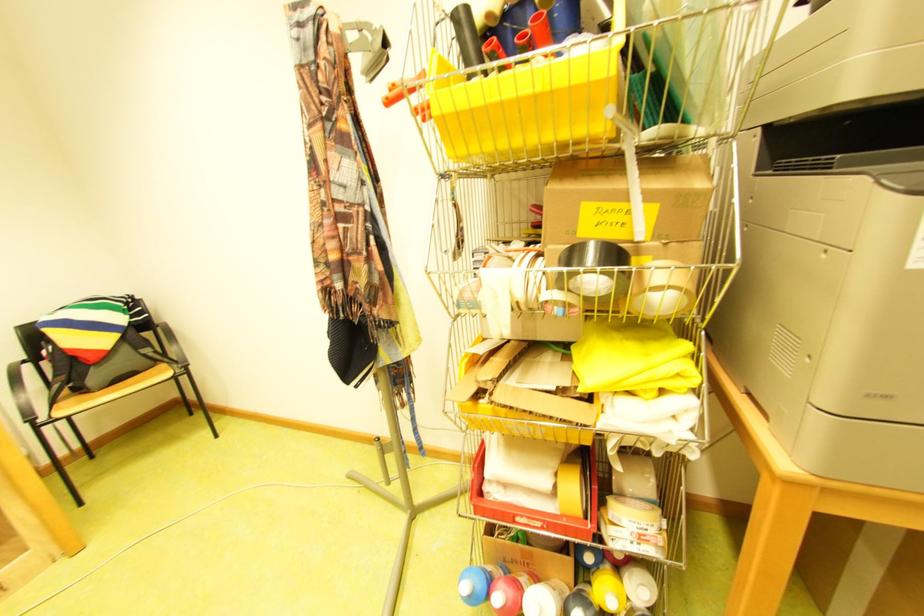
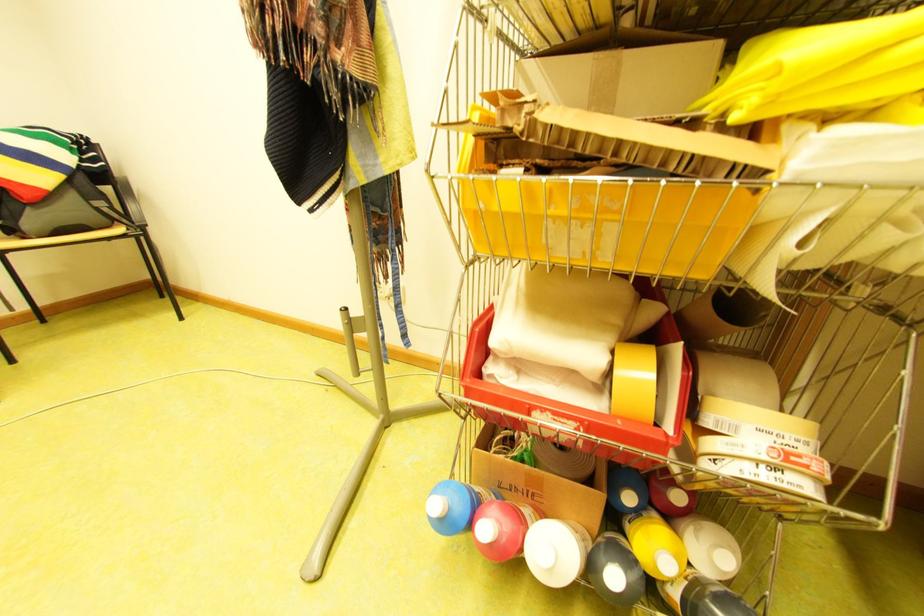
Where in the second image is the point corresponding to (x=567, y=472) from the first image?

(622, 347)